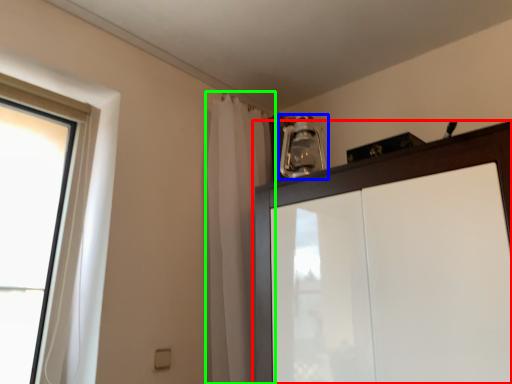
Question: Based on their relative distances, which object is farther from cupboard (highlighted by a red box)? Choose from light fixture (highlighted by a blue box) and shower curtain (highlighted by a green box).

Choices:
 (A) light fixture
 (B) shower curtain

Answer: (A)